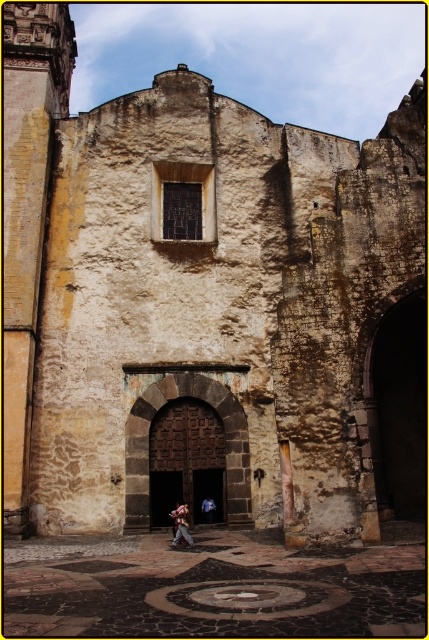
Does denim pants at center lie in front of blue denim jeans at center?

Yes, denim pants at center is in front of blue denim jeans at center.

Is denim pants at center to the right of blue denim jeans at center from the viewer's perspective?

No, denim pants at center is not to the right of blue denim jeans at center.

Which is behind, point (180, 518) or point (208, 522)?

Positioned behind is point (208, 522).

The width and height of the screenshot is (429, 640). Identify the location of denim pants at center. (181, 524).